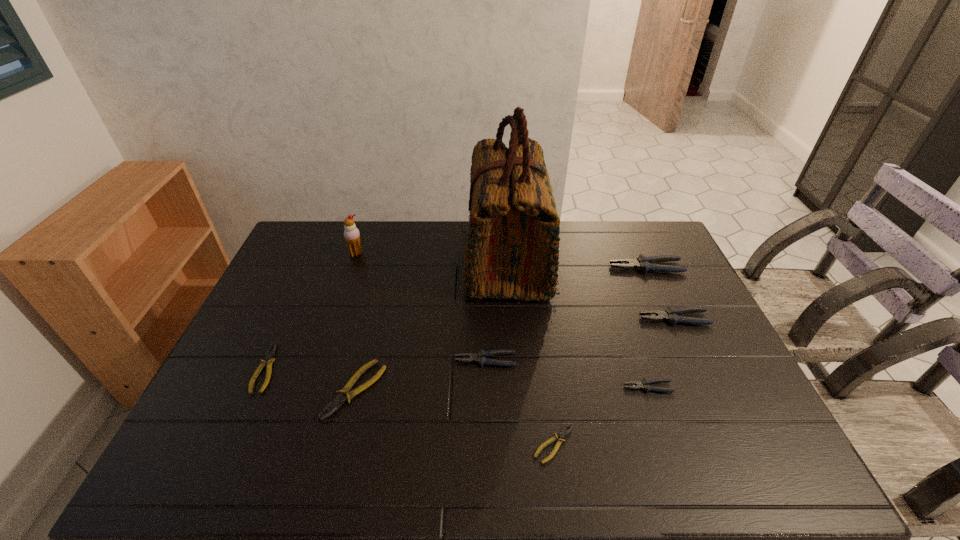
At what (x,y) coordinates should I click in order to perform the action: click on the sixth pliers from right to left. Please return your answer as a coordinate pair (x, y). The image size is (960, 540). Looking at the image, I should click on (343, 395).

Where is `the nearest gray pliers`? This screenshot has height=540, width=960. the nearest gray pliers is located at coordinates (644, 384).

I want to click on the second shortest object, so click(x=268, y=359).

I want to click on the leftmost pliers, so click(x=268, y=359).

This screenshot has width=960, height=540. Identify the location of the nearest object. (563, 433).

I want to click on the smallest yellow pliers, so click(563, 433).

The image size is (960, 540). Identify the location of vacant space situated 0.350m on the open handle side of the tallest object. (363, 259).

Locate an element on the screen. The height and width of the screenshot is (540, 960). vacant space positioned 0.320m on the open handle side of the tallest object is located at coordinates (372, 259).

You are a GUI agent. You are given a task and a screenshot of the screen. Output one action in this format:
    pyautogui.click(x=<x>, y=<y>)
    Task: Click on the free space located on the open handle side of the tallest object
    The height and width of the screenshot is (540, 960).
    Given the screenshot: What is the action you would take?
    pyautogui.click(x=434, y=259)

Identify the location of vacant position located 0.230m at the front with a straw on the icecream. Image resolution: width=960 pixels, height=540 pixels. (339, 303).